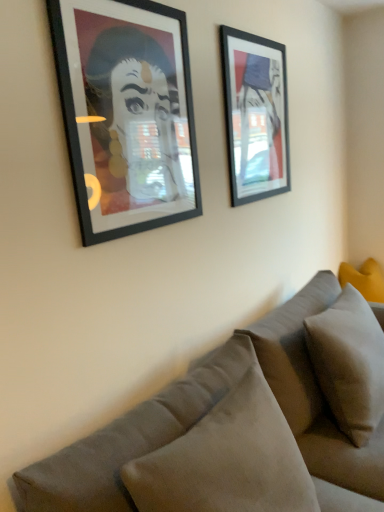
Question: Considering the positions of matte black picture frame at upper right, placed as the second picture frame when sorted from front to back, and velvet gray couch at lower right in the image, is matte black picture frame at upper right, placed as the second picture frame when sorted from front to back, taller or shorter than velvet gray couch at lower right?

Choices:
 (A) short
 (B) tall

Answer: (A)

Question: Based on their sizes in the image, would you say matte black picture frame at upper right, acting as the first picture frame starting from the right, is bigger or smaller than velvet gray couch at lower right?

Choices:
 (A) big
 (B) small

Answer: (B)

Question: Which object is positioned closest to the matte black picture frame at upper right, the second picture frame when ordered from left to right?

Choices:
 (A) velvet gray couch at lower right
 (B) yellow fabric pillow at right, the first pillow when ordered from back to front
 (C) matte black picture frame at left, the 1th picture frame when ordered from left to right
 (D) suede-like beige pillow at lower right, which appears as the third pillow when viewed from the back
 (E) light gray fabric pillow at lower right, the second pillow from the front

Answer: (C)

Question: Estimate the real-world distances between objects in this image. Which object is closer to the matte black picture frame at left, the 1th picture frame when ordered from left to right?

Choices:
 (A) matte black picture frame at upper right, the second picture frame when ordered from left to right
 (B) suede-like beige pillow at lower right, which appears as the third pillow when viewed from the back
 (C) yellow fabric pillow at right, arranged as the 1th pillow when viewed from the right
 (D) velvet gray couch at lower right
 (E) light gray fabric pillow at lower right, the second pillow from the front

Answer: (A)